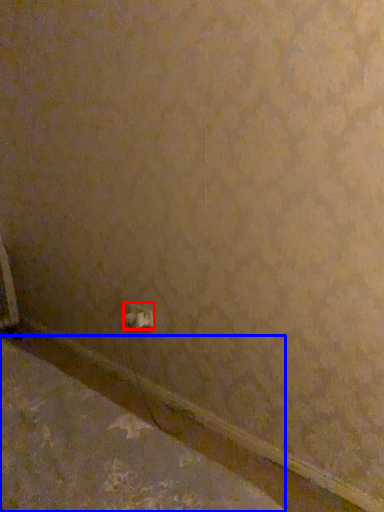
Question: Among these objects, which one is farthest to the camera, power plugs and sockets (highlighted by a red box) or concrete (highlighted by a blue box)?

Choices:
 (A) power plugs and sockets
 (B) concrete

Answer: (A)